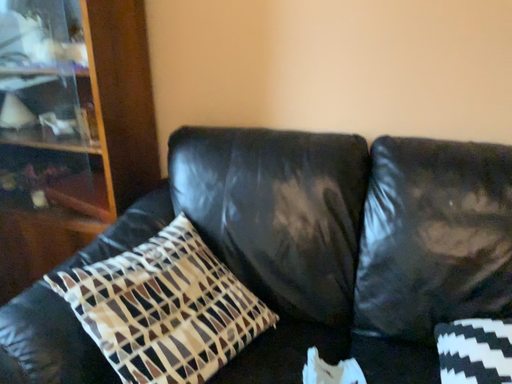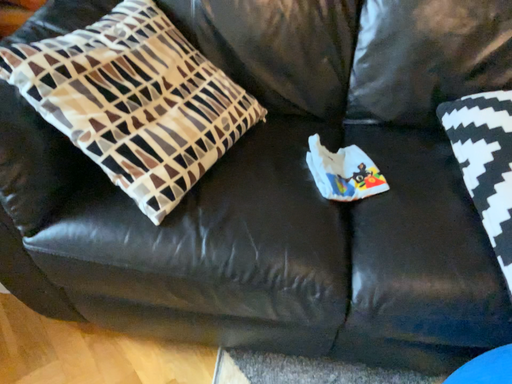
Question: Which way did the camera rotate in the video?

Choices:
 (A) rotated left
 (B) rotated right

Answer: (B)